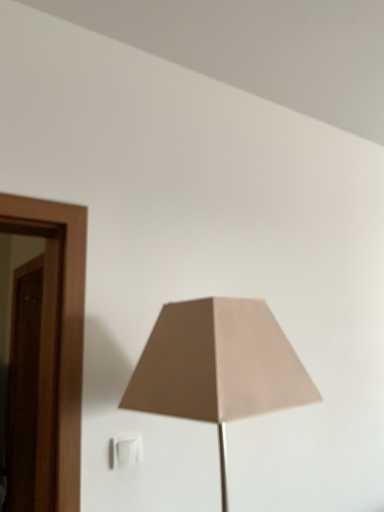
Question: Visually, is beige fabric lampshade at center positioned to the left or to the right of white plastic electric outlet at lower center?

Choices:
 (A) left
 (B) right

Answer: (B)

Question: Is beige fabric lampshade at center taller or shorter than white plastic electric outlet at lower center?

Choices:
 (A) tall
 (B) short

Answer: (A)

Question: Is point (240, 364) closer or farther from the camera than point (122, 448)?

Choices:
 (A) closer
 (B) farther

Answer: (A)

Question: From the image's perspective, is white plastic electric outlet at lower center positioned above or below beige fabric lampshade at center?

Choices:
 (A) above
 (B) below

Answer: (B)

Question: From their relative heights in the image, would you say white plastic electric outlet at lower center is taller or shorter than beige fabric lampshade at center?

Choices:
 (A) short
 (B) tall

Answer: (A)

Question: Is white plastic electric outlet at lower center to the left or to the right of beige fabric lampshade at center in the image?

Choices:
 (A) left
 (B) right

Answer: (A)

Question: In terms of size, does white plastic electric outlet at lower center appear bigger or smaller than beige fabric lampshade at center?

Choices:
 (A) big
 (B) small

Answer: (B)